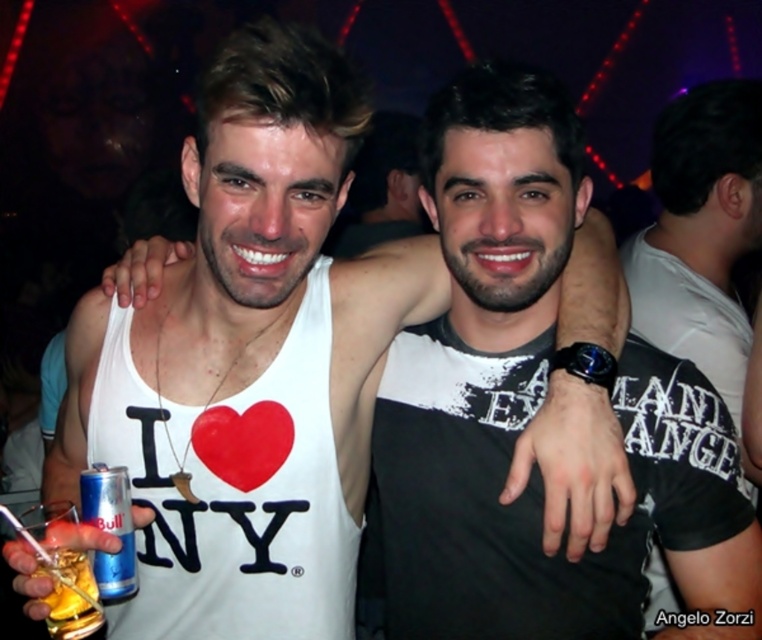
Between point (668, 163) and point (90, 477), which one is positioned in front?

Positioned in front is point (90, 477).

Which is behind, point (676, 202) or point (93, 468)?

The point (676, 202) is behind.

Identify the location of black matte tank top at center. Image resolution: width=762 pixels, height=640 pixels. click(700, 230).

Who is lower down, black matte tank top at center or translucent glass at lower left?

translucent glass at lower left is below.

Between black matte tank top at center and translucent glass at lower left, which one appears on the left side from the viewer's perspective?

translucent glass at lower left is more to the left.

Which is in front, point (711, 248) or point (91, 589)?

Point (91, 589) is in front.

At what (x,y) coordinates should I click in order to perform the action: click on black matte tank top at center. Please return your answer as a coordinate pair (x, y). Looking at the image, I should click on (700, 230).

In the scene shown: Does blue metallic can at lower left have a greater width compared to translucent glass at lower left?

Incorrect, blue metallic can at lower left's width does not surpass translucent glass at lower left's.

Is blue metallic can at lower left taller than translucent glass at lower left?

Yes, blue metallic can at lower left is taller than translucent glass at lower left.

Measure the distance between point [133,547] and camera.

Point [133,547] is 1.06 meters away from camera.

This screenshot has height=640, width=762. I want to click on blue metallic can at lower left, so click(110, 528).